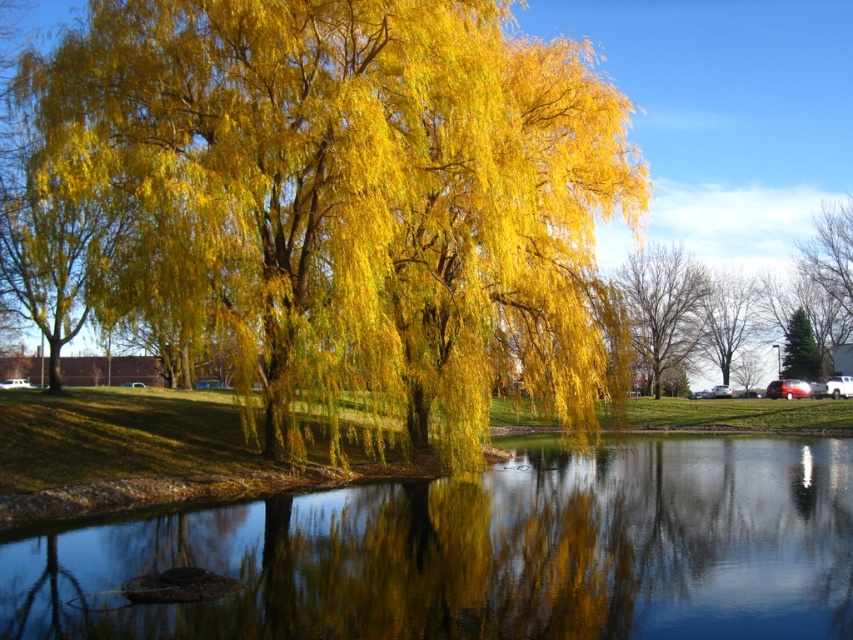
You are standing by the water and want to take a photo of both the smooth reflective water at center and the smooth bark tree at center. Which object will appear larger in the photo?

The smooth reflective water at center appears smaller in the photo compared to the smooth bark tree at center because the description states it has a smaller size.

You are standing at the edge of the water and notice the golden yellow leaves at center and the smooth reflective water at center. Which object is taller?

The golden yellow leaves at center are taller than the smooth reflective water at center.

You are a photographer wanting to capture the reflection of the golden yellow leaves at center and the smooth bark tree at center in the water. Which object will appear closer to the bottom edge of your photo?

The smooth bark tree at center will appear closer to the bottom edge of the photo because the golden yellow leaves at center is above it.